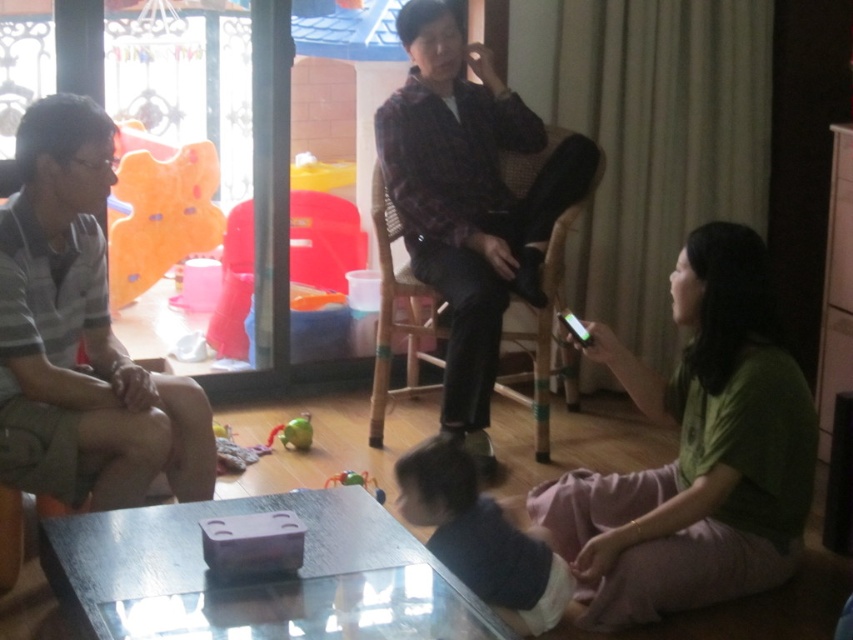
Question: Does dark blue fabric at lower center appear under soft plush bear at upper left?

Choices:
 (A) yes
 (B) no

Answer: (A)

Question: Is the position of green rubber toy at center less distant than that of rubberized green spider at lower center?

Choices:
 (A) yes
 (B) no

Answer: (B)

Question: Which is farther from the transparent glass table at lower center?

Choices:
 (A) transparent plastic glass door at left
 (B) green matte shirt at lower right
 (C) rubberized green spider at lower center

Answer: (A)

Question: Observing the image, what is the correct spatial positioning of transparent glass table at lower center in reference to transparent plastic glass door at left?

Choices:
 (A) above
 (B) below

Answer: (B)

Question: Which of these objects is positioned farthest from the green matte shirt at lower right?

Choices:
 (A) rubberized green spider at lower center
 (B) striped cotton shirt at left

Answer: (B)

Question: Among these objects, which one is nearest to the camera?

Choices:
 (A) transparent glass table at lower center
 (B) plaid fabric shirt at center
 (C) dark blue fabric at lower center

Answer: (A)